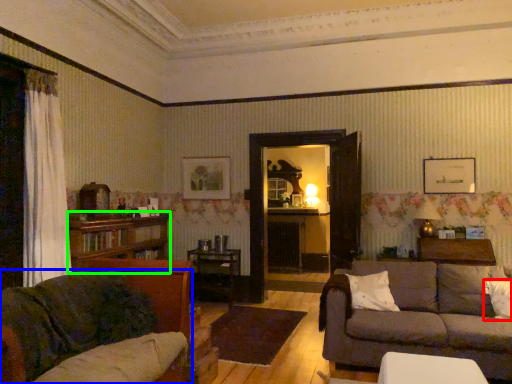
Question: Which is nearer to the pillow (highlighted by a red box)? studio couch (highlighted by a blue box) or bookcase (highlighted by a green box).

Choices:
 (A) studio couch
 (B) bookcase

Answer: (A)